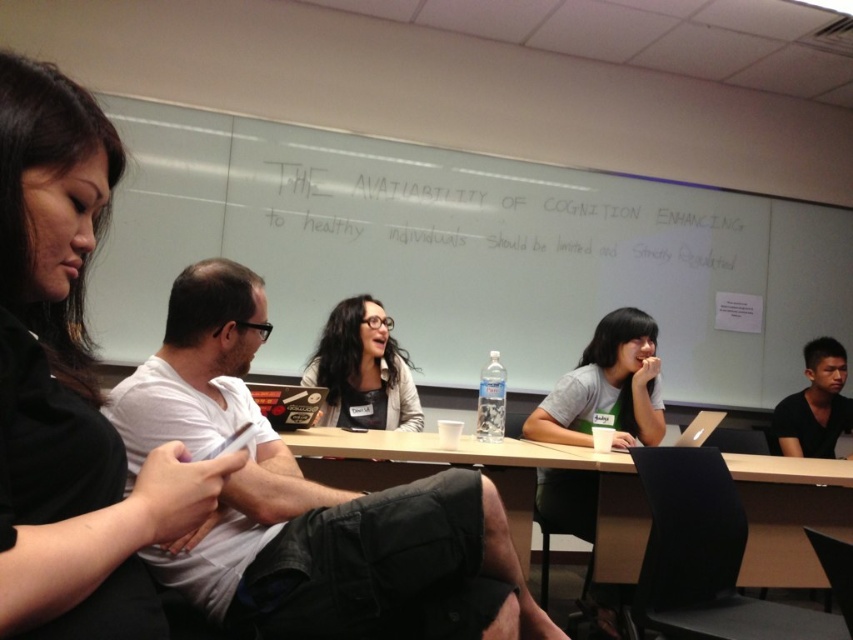
In the scene shown: Who is lower down, whiteboard at upper center or white cotton shirt at center?

white cotton shirt at center

This screenshot has width=853, height=640. Describe the element at coordinates (467, 253) in the screenshot. I see `whiteboard at upper center` at that location.

Is point (236, 145) in front of point (225, 385)?

No, it is not.

The height and width of the screenshot is (640, 853). I want to click on whiteboard at upper center, so click(467, 253).

Who is lower down, brown wooden table at center or clear plastic water bottle at center?

brown wooden table at center is below.

Does point (556, 448) come farther from viewer compared to point (489, 381)?

That is True.

Does point (492, 460) lie in front of point (491, 368)?

Yes, it is.

At what (x,y) coordinates should I click in order to perform the action: click on brown wooden table at center. Please return your answer as a coordinate pair (x, y). The image size is (853, 640). Looking at the image, I should click on (514, 484).

Who is taller, gray matte shirt at center or clear plastic water bottle at center?

Standing taller between the two is gray matte shirt at center.

Is gray matte shirt at center thinner than clear plastic water bottle at center?

No.

Locate an element on the screen. The image size is (853, 640). gray matte shirt at center is located at coordinates (606, 387).